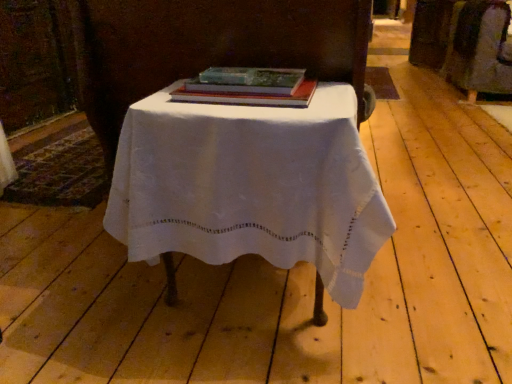
Question: Is translucent green glass book at center to the right of white cloth-covered table at center from the viewer's perspective?

Choices:
 (A) no
 (B) yes

Answer: (A)

Question: Is the depth of translucent green glass book at center greater than that of white cloth-covered table at center?

Choices:
 (A) no
 (B) yes

Answer: (B)

Question: Does translucent green glass book at center have a lesser height compared to white cloth-covered table at center?

Choices:
 (A) yes
 (B) no

Answer: (A)

Question: Can you confirm if translucent green glass book at center is thinner than white cloth-covered table at center?

Choices:
 (A) yes
 (B) no

Answer: (A)

Question: Is translucent green glass book at center smaller than white cloth-covered table at center?

Choices:
 (A) yes
 (B) no

Answer: (A)

Question: From a real-world perspective, is translucent green glass book at center positioned under white cloth-covered table at center based on gravity?

Choices:
 (A) yes
 (B) no

Answer: (B)

Question: From the image's perspective, would you say white cloth-covered table at center is positioned over translucent green glass book at center?

Choices:
 (A) no
 (B) yes

Answer: (A)

Question: Does white cloth-covered table at center have a lesser width compared to translucent green glass book at center?

Choices:
 (A) no
 (B) yes

Answer: (A)

Question: Considering the relative positions of white cloth-covered table at center and translucent green glass book at center in the image provided, is white cloth-covered table at center behind translucent green glass book at center?

Choices:
 (A) yes
 (B) no

Answer: (B)

Question: Is translucent green glass book at center a part of white cloth-covered table at center?

Choices:
 (A) yes
 (B) no

Answer: (B)

Question: From a real-world perspective, is white cloth-covered table at center beneath translucent green glass book at center?

Choices:
 (A) no
 (B) yes

Answer: (B)

Question: Is white cloth-covered table at center aimed at translucent green glass book at center?

Choices:
 (A) no
 (B) yes

Answer: (A)

Question: Is point (304, 79) closer or farther from the camera than point (352, 188)?

Choices:
 (A) closer
 (B) farther

Answer: (B)